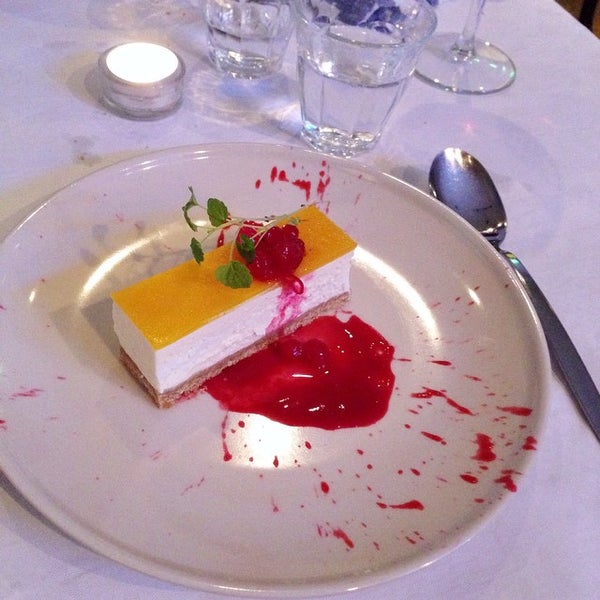
Find the location of a particular element. spoon is located at coordinates (465, 177).